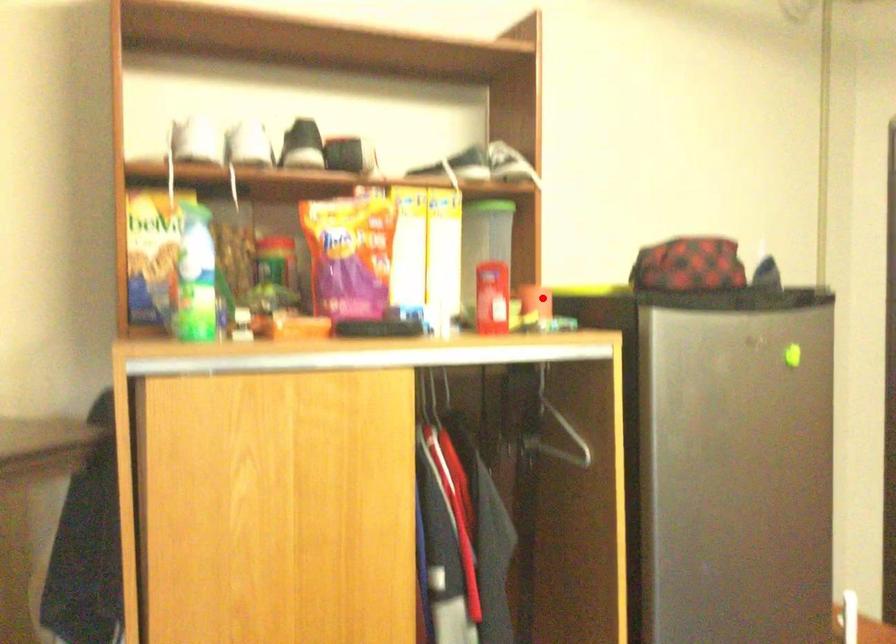
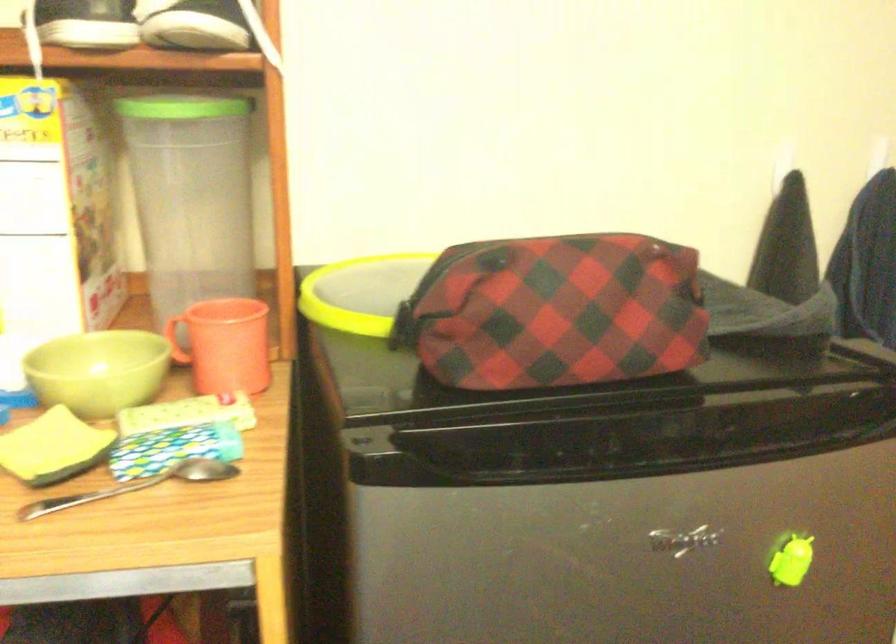
Question: I am providing you with two images of the same scene from different viewpoints. Given a red point in image1, look at the same physical point in image2. Is it:

Choices:
 (A) Closer to the viewpoint
 (B) Farther from the viewpoint

Answer: (A)